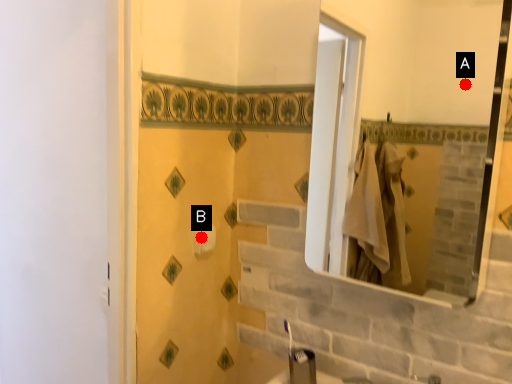
Question: Two points are circled on the image, labeled by A and B beside each circle. Which point is farther to the camera?

Choices:
 (A) A is further
 (B) B is further

Answer: (A)